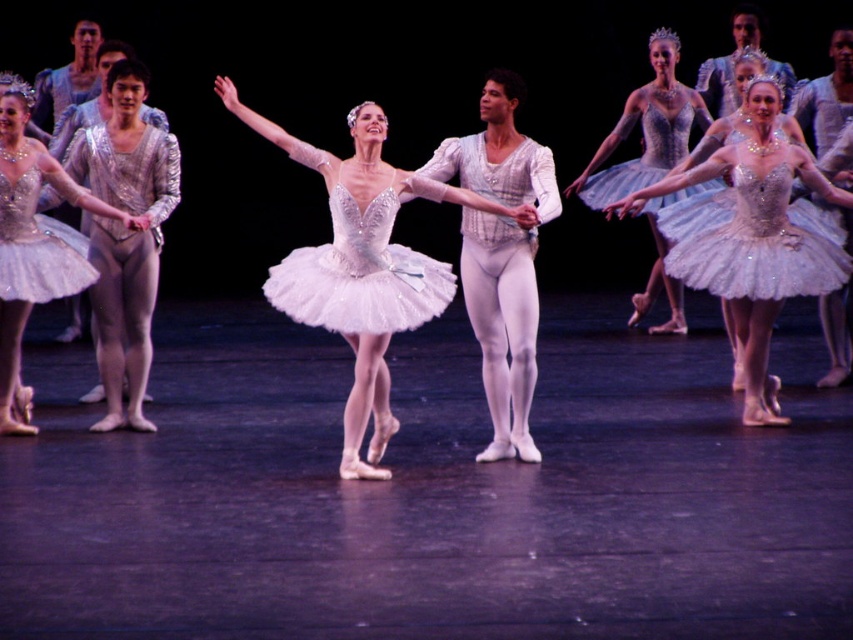
Question: Considering the real-world distances, which object is closest to the white tulle tutu at center?

Choices:
 (A) sparkling silver tutu at center
 (B) matte silver tutu at left
 (C) shiny silver tutu at center
 (D) silver sequined tutu at upper right

Answer: (C)

Question: Can you confirm if matte silver tutu at left is smaller than silver sequined tutu at upper right?

Choices:
 (A) yes
 (B) no

Answer: (A)

Question: In this image, where is shiny silver tutu at center located relative to white tulle tutu at center?

Choices:
 (A) right
 (B) left

Answer: (A)

Question: Considering the real-world distances, which object is farthest from the silver sequined tutu at upper right?

Choices:
 (A) white tulle tutu at center
 (B) shiny silver tutu at center

Answer: (A)

Question: Is sparkling silver tutu at center positioned at the back of white tulle tutu at center?

Choices:
 (A) no
 (B) yes

Answer: (B)

Question: Among these points, which one is farthest from the camera?

Choices:
 (A) (287, 282)
 (B) (20, 152)
 (C) (680, 148)

Answer: (C)